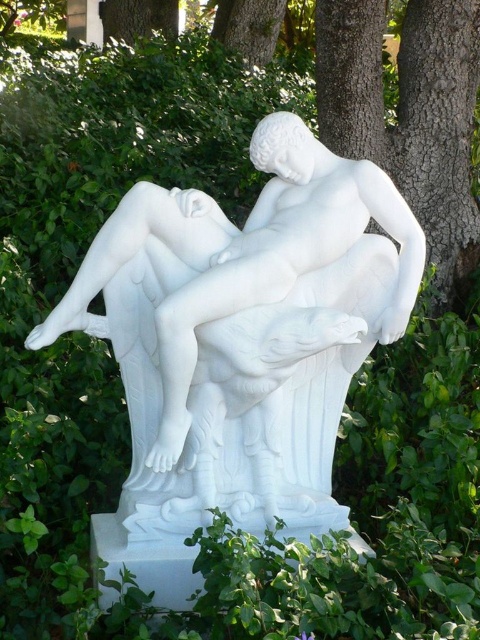
Question: Is white marble statue at center to the right of brown rough tree trunk at upper center from the viewer's perspective?

Choices:
 (A) no
 (B) yes

Answer: (A)

Question: Which of the following is the farthest from the observer?

Choices:
 (A) (451, 244)
 (B) (190, 317)

Answer: (A)

Question: Is white marble statue at center to the left of brown rough tree trunk at upper center from the viewer's perspective?

Choices:
 (A) yes
 (B) no

Answer: (A)

Question: Which of the following is the farthest from the observer?

Choices:
 (A) (273, 444)
 (B) (455, 13)

Answer: (B)

Question: Does white marble statue at center appear under brown rough tree trunk at upper center?

Choices:
 (A) no
 (B) yes

Answer: (B)

Question: Which of the following is the closest to the observer?

Choices:
 (A) (180, 378)
 (B) (408, 86)

Answer: (A)